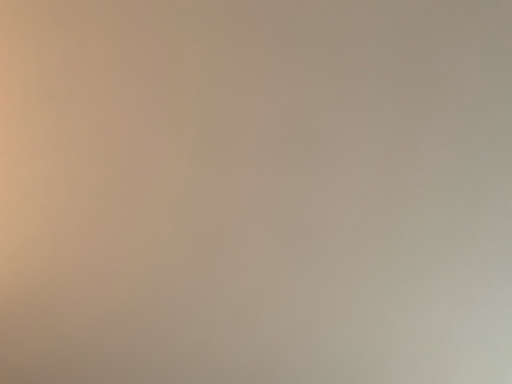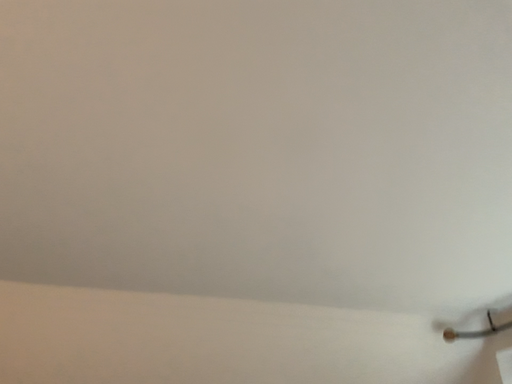
Question: Which way did the camera rotate in the video?

Choices:
 (A) rotated downward
 (B) rotated upward

Answer: (A)